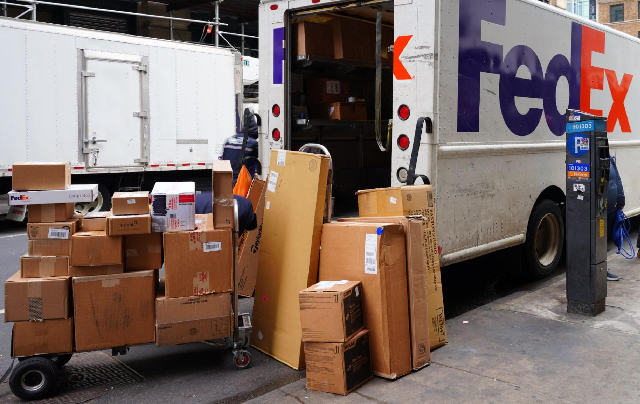
Locate an element on the screen. This screenshot has width=640, height=404. entry is located at coordinates (331, 85).